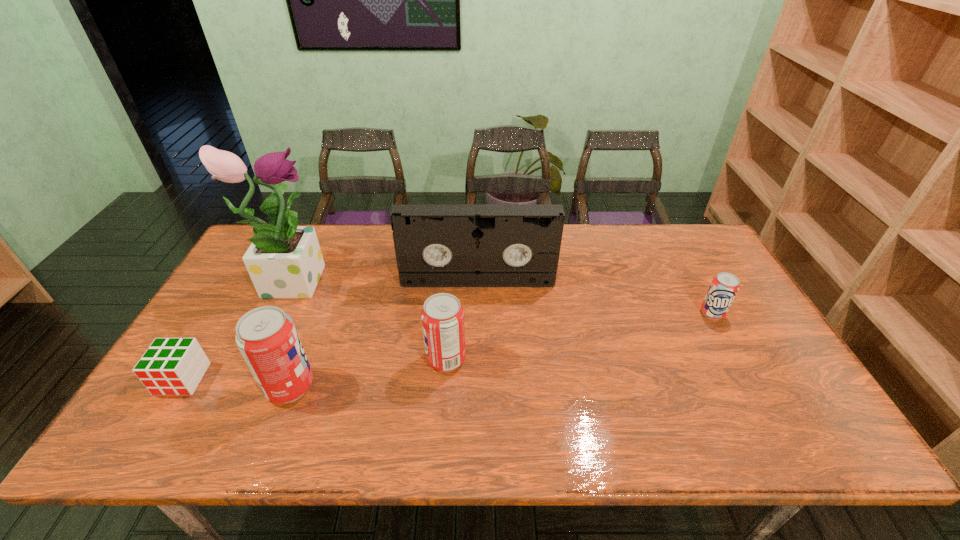
To make them evenly spaced by inserting another pop_(soda) among them, please locate a free space for this new pop_(soda). Please provide its 2D coordinates. Your answer should be formatted as a tuple, i.e. [(x, y)], where the tuple contains the x and y coordinates of a point satisfying the conditions above.

[(586, 335)]